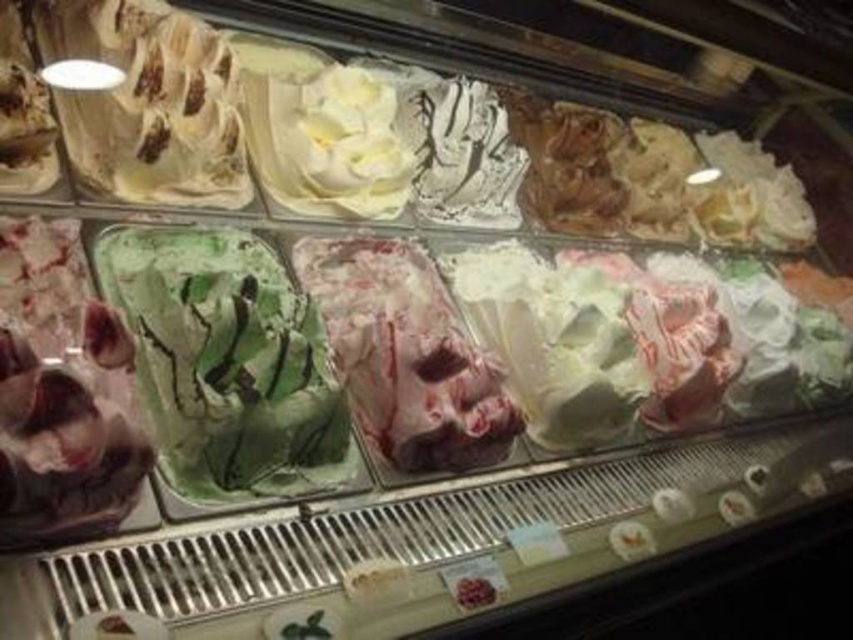
Is green swirled ice cream at center shorter than swirled pink ice cream at center?

Yes, green swirled ice cream at center is shorter than swirled pink ice cream at center.

Image resolution: width=853 pixels, height=640 pixels. I want to click on green swirled ice cream at center, so click(227, 364).

Image resolution: width=853 pixels, height=640 pixels. I want to click on green swirled ice cream at center, so click(x=227, y=364).